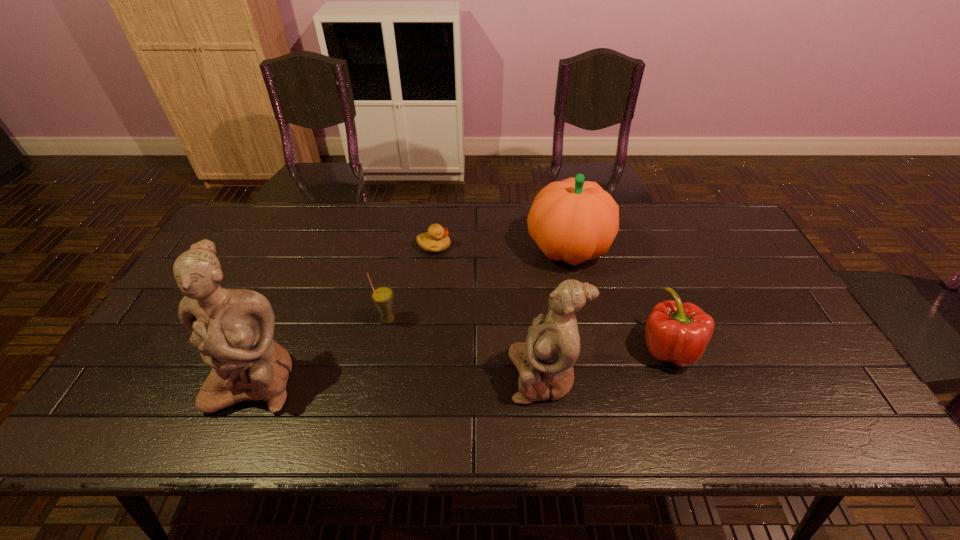
Where is `vacant space situated on the front-facing side of the right figurine`? The width and height of the screenshot is (960, 540). vacant space situated on the front-facing side of the right figurine is located at coordinates (420, 376).

Locate an element on the screen. The height and width of the screenshot is (540, 960). free space located 0.300m at the beak of the duckling is located at coordinates (544, 246).

Find the location of a particular element. blank area located 0.220m on the front of the pumpkin is located at coordinates (587, 339).

At what (x,y) coordinates should I click in order to perform the action: click on free region located on the front of the second object from left to right. Please return your answer as a coordinate pair (x, y). The height and width of the screenshot is (540, 960). Looking at the image, I should click on (374, 387).

The image size is (960, 540). In order to click on free spot located 0.390m on the left of the pepper in this screenshot , I will do `click(487, 348)`.

Where is `duckling present at the far edge`? duckling present at the far edge is located at coordinates (436, 240).

The height and width of the screenshot is (540, 960). Identify the location of pumpkin present at the far edge. (572, 220).

Image resolution: width=960 pixels, height=540 pixels. Find the location of `pepper that is at the near edge`. pepper that is at the near edge is located at coordinates (676, 332).

This screenshot has width=960, height=540. What are the coordinates of `free location at the far edge` in the screenshot? It's located at (642, 217).

The height and width of the screenshot is (540, 960). I want to click on vacant space at the right edge of the desktop, so click(x=757, y=269).